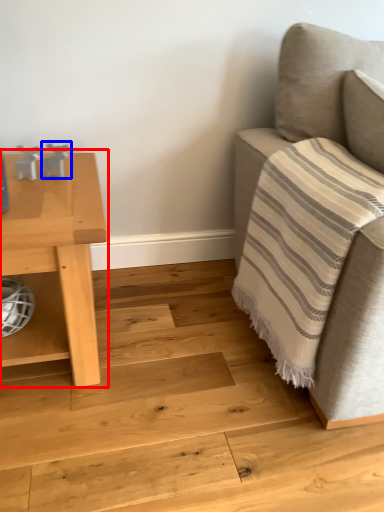
Question: Among these objects, which one is farthest to the camera, table (highlighted by a red box) or toy (highlighted by a blue box)?

Choices:
 (A) table
 (B) toy

Answer: (B)